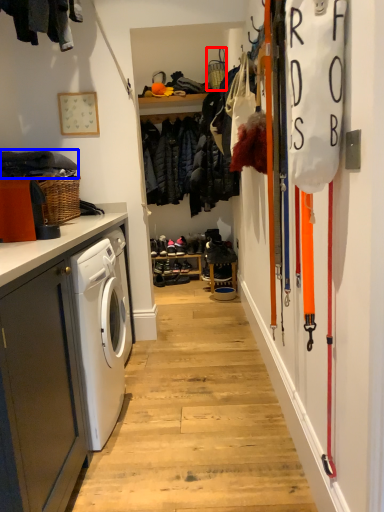
Question: Among these objects, which one is nearest to the camera, basket (highlighted by a red box) or clothing (highlighted by a blue box)?

Choices:
 (A) basket
 (B) clothing

Answer: (B)